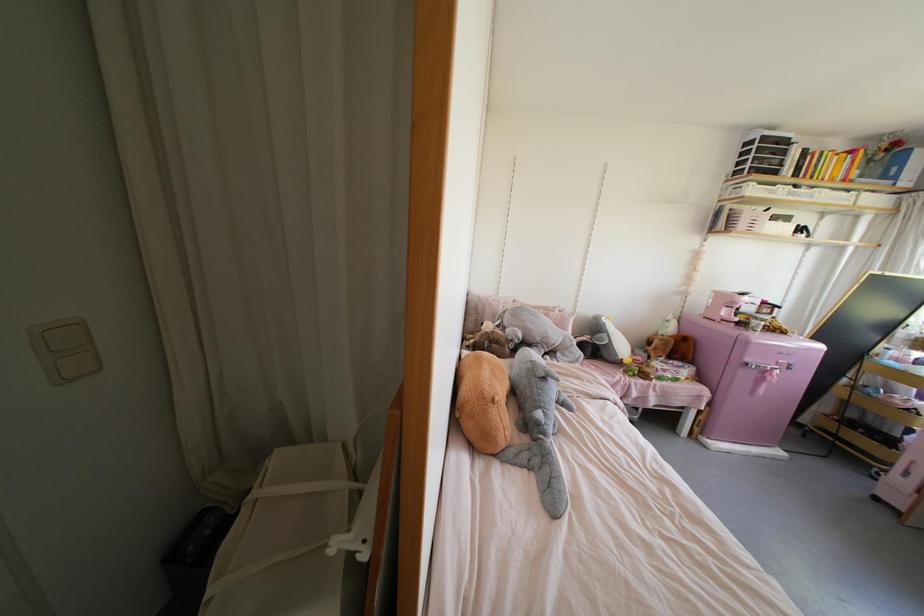
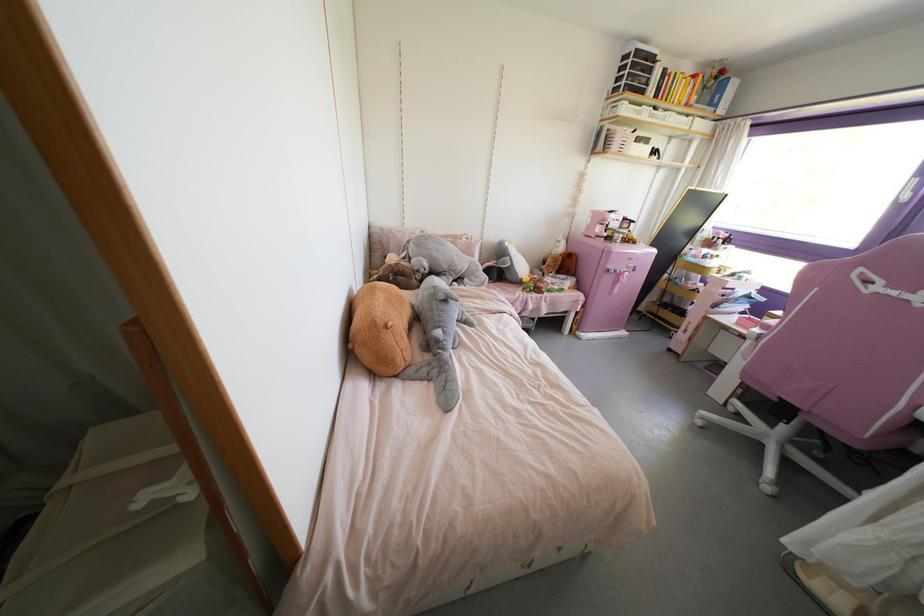
The point at (x=274, y=450) is marked in the first image. Where is the corresponding point in the second image?

(92, 428)